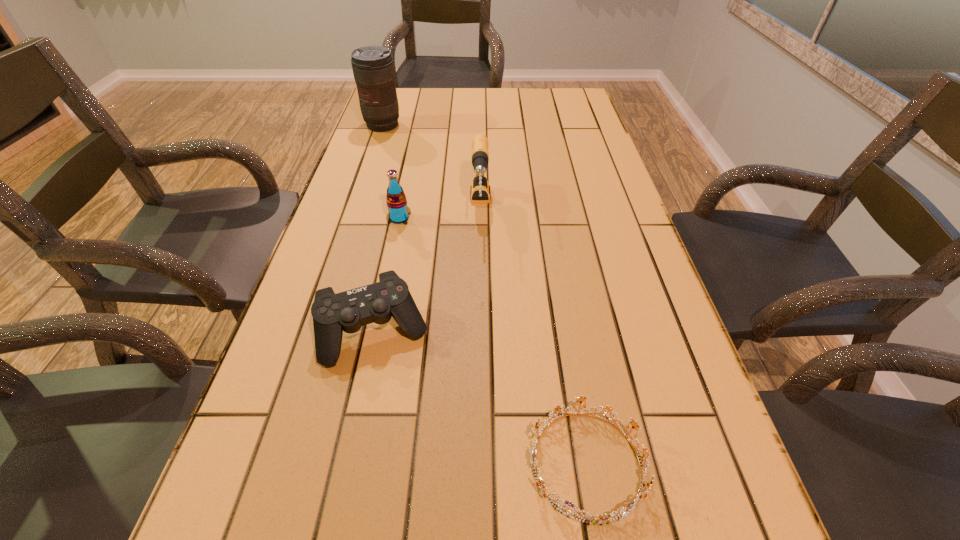
Locate an element on the screen. The height and width of the screenshot is (540, 960). object that is the third closest to the soda is located at coordinates (373, 68).

Where is `vacant space that satisfies the following two spatial constraints: 1. on the side of the farthest object where the control switches are located; 2. on the left side of the fourth tallest object`? The width and height of the screenshot is (960, 540). vacant space that satisfies the following two spatial constraints: 1. on the side of the farthest object where the control switches are located; 2. on the left side of the fourth tallest object is located at coordinates (313, 332).

You are a GUI agent. You are given a task and a screenshot of the screen. Output one action in this format:
    pyautogui.click(x=<x>, y=<y>)
    Task: Click on the vacant space that satisfies the following two spatial constraints: 1. on the side of the soda where the control switches are located; 2. on the right side of the farthest object
    This screenshot has width=960, height=540.
    Given the screenshot: What is the action you would take?
    pyautogui.click(x=351, y=218)

Where is `vacant space that satisfies the following two spatial constraints: 1. on the side of the tallest object where the control switches are located; 2. on the right side of the soda`? vacant space that satisfies the following two spatial constraints: 1. on the side of the tallest object where the control switches are located; 2. on the right side of the soda is located at coordinates (351, 218).

This screenshot has width=960, height=540. What are the coordinates of `vacant space that satisfies the following two spatial constraints: 1. on the side of the telephoto lens where the control switches are located; 2. on the left side of the soda` in the screenshot? It's located at (351, 218).

The width and height of the screenshot is (960, 540). I want to click on vacant area in the image that satisfies the following two spatial constraints: 1. on the side of the fourth tallest object where the control switches are located; 2. on the right side of the tallest object, so click(x=313, y=332).